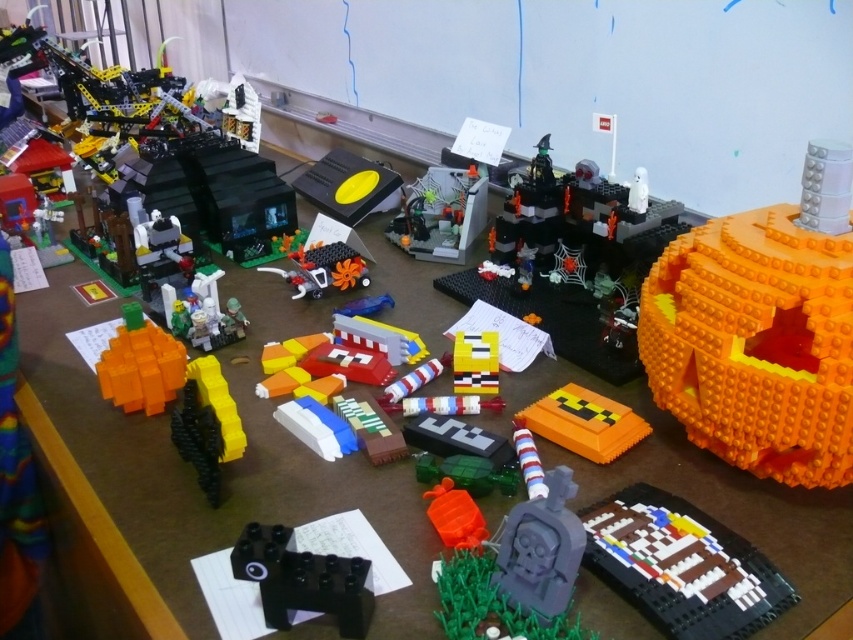
Question: Is orange matte pumpkin at right wider than black matte block at lower left?

Choices:
 (A) yes
 (B) no

Answer: (A)

Question: Which point is farther to the camera?

Choices:
 (A) (816, 282)
 (B) (451, 241)

Answer: (B)

Question: Where is orange matte pumpkin at lower left located in relation to orange matte pumpkin at center in the image?

Choices:
 (A) right
 (B) left

Answer: (B)

Question: Can you confirm if brown matte house at lower right is thinner than black matte block at lower left?

Choices:
 (A) no
 (B) yes

Answer: (A)

Question: Which point appears farthest from the camera in this image?

Choices:
 (A) (567, 467)
 (B) (486, 387)
 (C) (701, 584)
 (D) (344, 616)

Answer: (B)

Question: Based on their relative distances, which object is nearer to the smooth gray gravestone at center?

Choices:
 (A) orange matte pumpkin at right
 (B) orange matte pumpkin at lower left
 (C) orange matte turtle at center
 (D) yellow matte brick at center

Answer: (C)